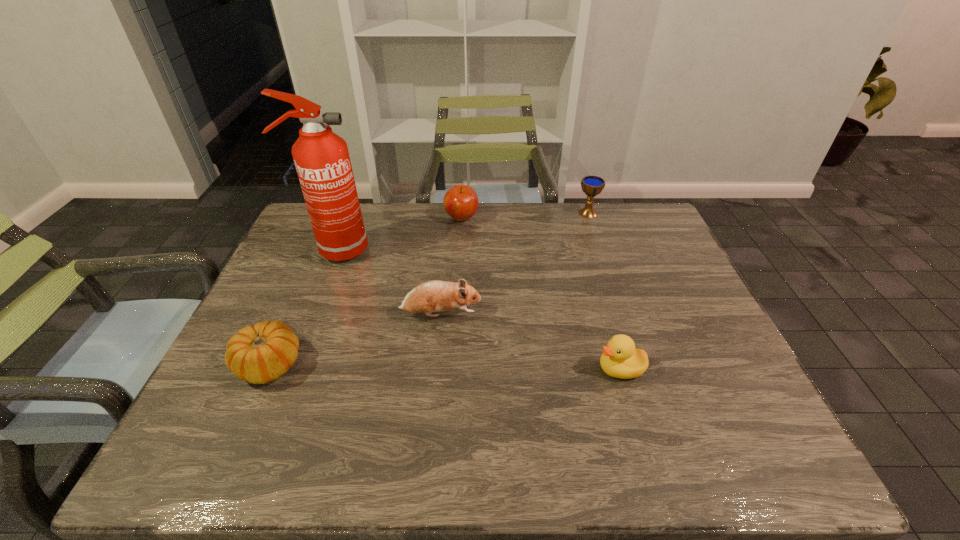
In order to click on vacant space positioned 0.200m at the face of the hamster in this screenshot , I will do `click(559, 315)`.

The height and width of the screenshot is (540, 960). I want to click on free location located on the face of the duckling, so click(535, 369).

You are a GUI agent. You are given a task and a screenshot of the screen. Output one action in this format:
    pyautogui.click(x=<x>, y=<y>)
    Task: Click on the vacant space located on the face of the duckling
    
    Given the screenshot: What is the action you would take?
    pyautogui.click(x=456, y=369)

Find the location of a particular element. Image resolution: width=960 pixels, height=540 pixels. vacant space located on the face of the duckling is located at coordinates (473, 369).

Image resolution: width=960 pixels, height=540 pixels. In order to click on vacant space situated 0.330m on the right of the gourd in this screenshot , I will do `click(445, 365)`.

What are the coordinates of `fire extinguisher that is at the far edge` in the screenshot? It's located at (321, 157).

Locate an element on the screen. chalice located at the far edge is located at coordinates (591, 185).

This screenshot has width=960, height=540. I want to click on apple at the far edge, so click(461, 202).

At what (x,y) coordinates should I click in order to perform the action: click on fire extinguisher that is at the left edge. Please return your answer as a coordinate pair (x, y). The height and width of the screenshot is (540, 960). Looking at the image, I should click on (321, 157).

What are the coordinates of `gourd situated at the left edge` in the screenshot? It's located at (259, 354).